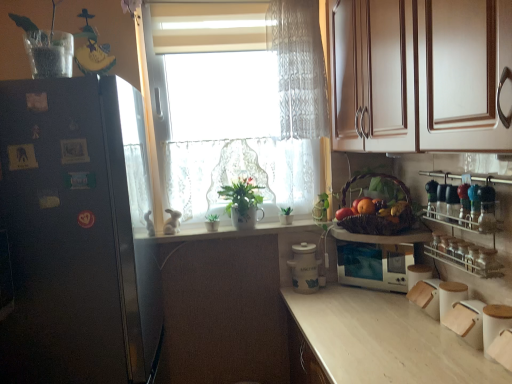
You are a GUI agent. You are given a task and a screenshot of the screen. Output one action in this format:
    pyautogui.click(x=<x>, y=<y>)
    Task: Click on the vacant space to the right of green matte houseplant at center, the third houseplant when ordered from right to left
    This screenshot has height=384, width=512.
    Given the screenshot: What is the action you would take?
    (x=241, y=228)